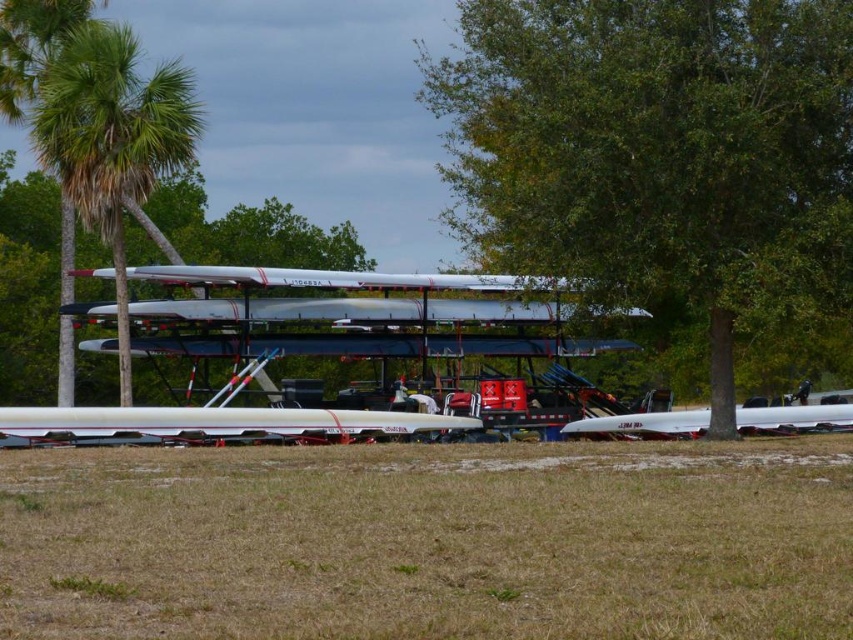
Question: Among these objects, which one is nearest to the camera?

Choices:
 (A) green leafy palm tree at left
 (B) white matte boat at lower right

Answer: (B)

Question: Can you confirm if white glossy rowboat at lower center is wider than white matte boat at lower right?

Choices:
 (A) yes
 (B) no

Answer: (A)

Question: Which point is closer to the camera taking this photo?

Choices:
 (A) (265, 426)
 (B) (405, 570)
 (C) (102, 100)

Answer: (B)

Question: Which of the following is the closest to the observer?

Choices:
 (A) (764, 586)
 (B) (817, 416)
 (C) (724, 61)

Answer: (A)

Question: Can you confirm if green leafy tree at center is smaller than white matte boat at lower right?

Choices:
 (A) yes
 (B) no

Answer: (B)

Question: Does green leafy palm tree at left have a greater width compared to white matte boat at lower right?

Choices:
 (A) no
 (B) yes

Answer: (A)